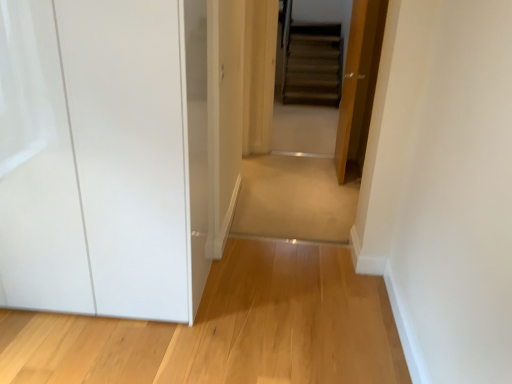
The image size is (512, 384). I want to click on vacant area that is situated to the right of transparent glossy cabinet at left, so click(x=240, y=320).